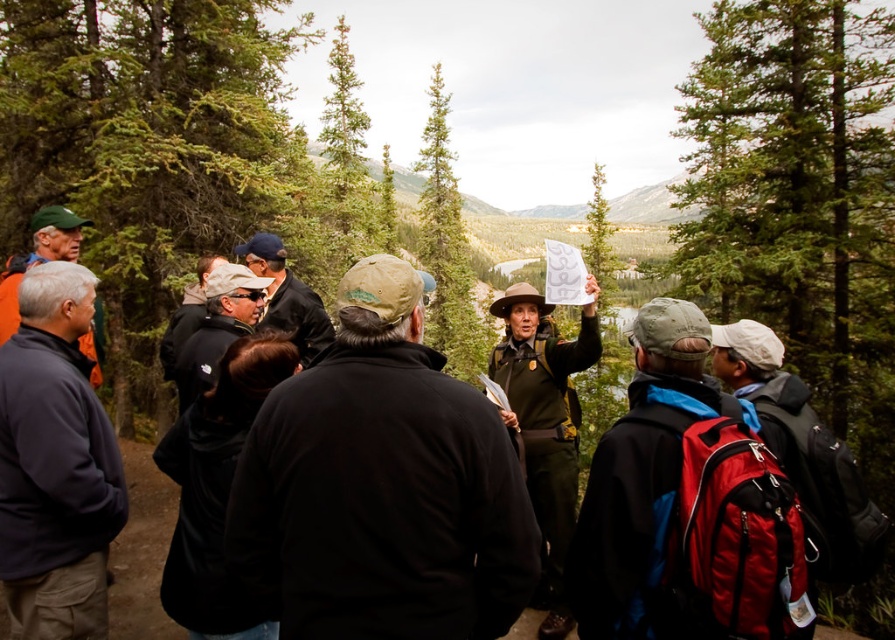
You are planning to set up a picnic blanket between the dark blue fleece at left and the green textured pine tree at center. The picnic blanket requires 20 meters of space between the two objects to be placed comfortably. Can you fit the picnic blanket between them?

The dark blue fleece at left and green textured pine tree at center are 21.80 meters apart, so yes, the picnic blanket can be placed comfortably between them as there is sufficient space.

In the forest scene, there are a dark blue fleece at left and a green textured pine tree at center. Which object is positioned to the left of the other?

The dark blue fleece at left is to the left of the green textured pine tree at center.

You are a photographer trying to capture a clear shot of the dark blue fleece at left and the green textured pine tree at center. Which object will appear narrower in your photo?

The dark blue fleece at left is thinner than the green textured pine tree at center, so it will appear narrower in the photo.